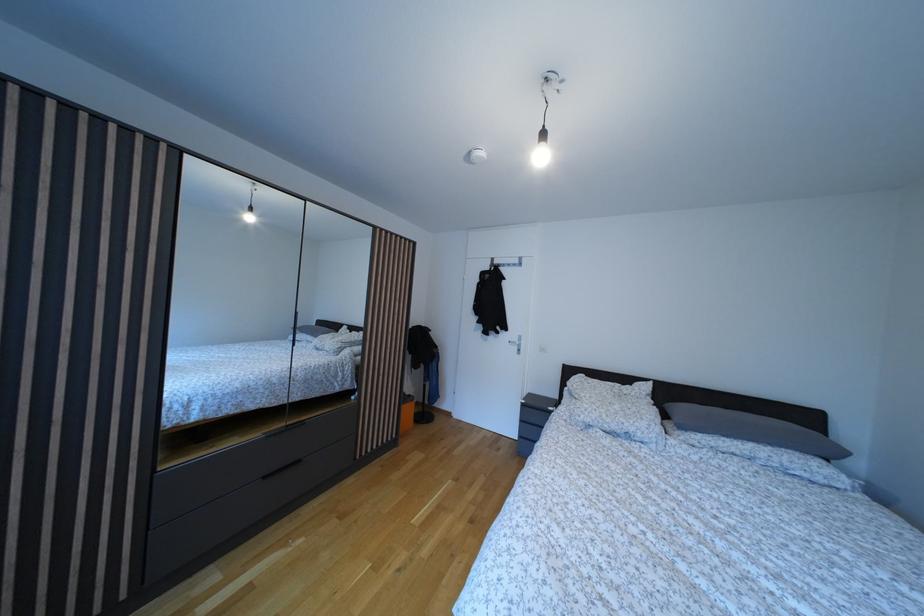
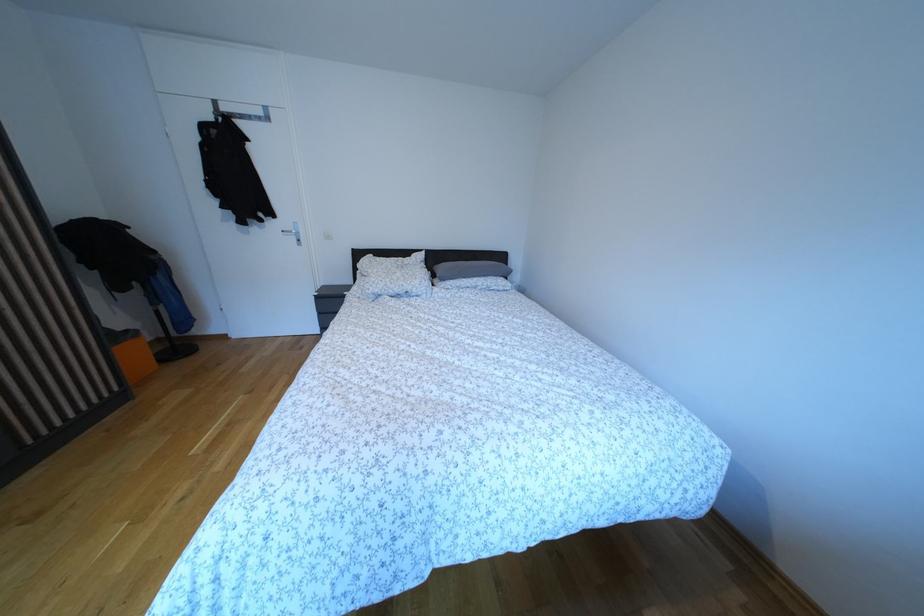
The point at (x=687, y=416) is marked in the first image. Where is the corresponding point in the second image?

(447, 274)